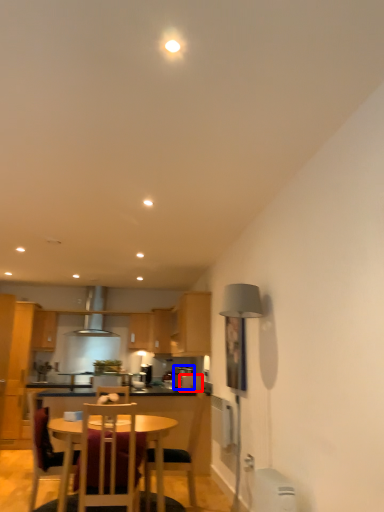
Question: Which object appears farthest to the camera in this image, appliance (highlighted by a red box) or appliance (highlighted by a blue box)?

Choices:
 (A) appliance
 (B) appliance

Answer: (B)